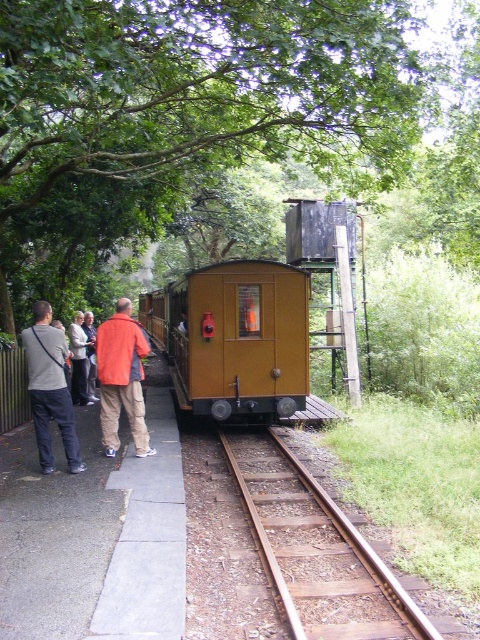
You are a passenger standing on the platform at the gray cotton shirt at left. The train is about to depart. You need to reach the matte yellow train at center before it leaves. Can you make it if you can run 10 feet per second?

The distance between the matte yellow train at center and the gray cotton shirt at left is 18.89 feet. Since you can run at 10 feet per second, it would take approximately 1.889 seconds to cover the distance. Therefore, you can reach the matte yellow train at center before it departs.

You are a photographer standing on the platform at the railway station. You want to take a photo of the green leafy tree at upper center and the brown wooden train track at center. Which object will appear taller in your photo?

The green leafy tree at upper center will appear taller in the photo because it has a greater height compared to the brown wooden train track at center.

You are a visitor at the railway station and want to know if you can safely walk under the matte yellow train at center while it is stationary on the tracks. Considering the height of the train and the average height of a person wearing the gray cotton shirt at left, will there be enough clearance?

The matte yellow train at center is much taller than the gray cotton shirt at left, so there should be sufficient clearance for a person of average height to walk underneath safely.